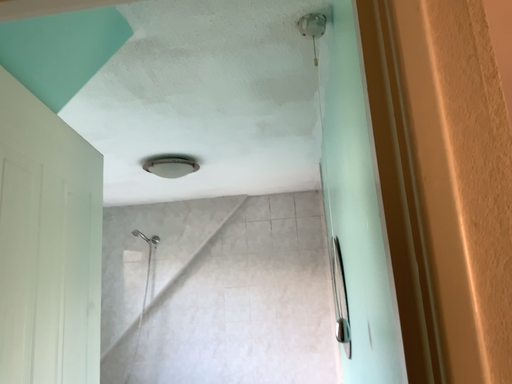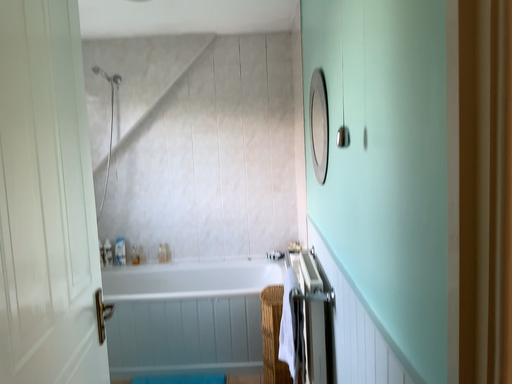
Question: How did the camera likely rotate when shooting the video?

Choices:
 (A) rotated upward
 (B) rotated downward

Answer: (B)